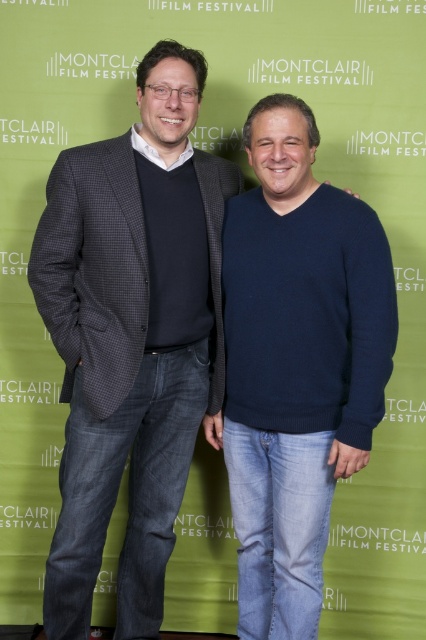
You are a photographer at the Montclair Film Festival. You need to capture a photo of the two people in front of the green backdrop. The festival requires that the person wearing the dark gray textured blazer at left must be positioned to the left of the dark blue sweater at center in the final image. Based on the current arrangement, will this requirement be met?

Yes, the requirement is already met because the dark gray textured blazer at left is positioned to the left of the dark blue sweater at center as described in the Objects Description.

You are a costume designer preparing for a play. You have two items to choose from for the main character. The dark gray textured blazer at left and the dark blue sweater at center. Which item would you recommend if the character needs to appear more authoritative?

The dark gray textured blazer at left is larger in size than the dark blue sweater at center, so the dark gray textured blazer at left would be more suitable for an authoritative look as it creates a more imposing presence due to its larger size.